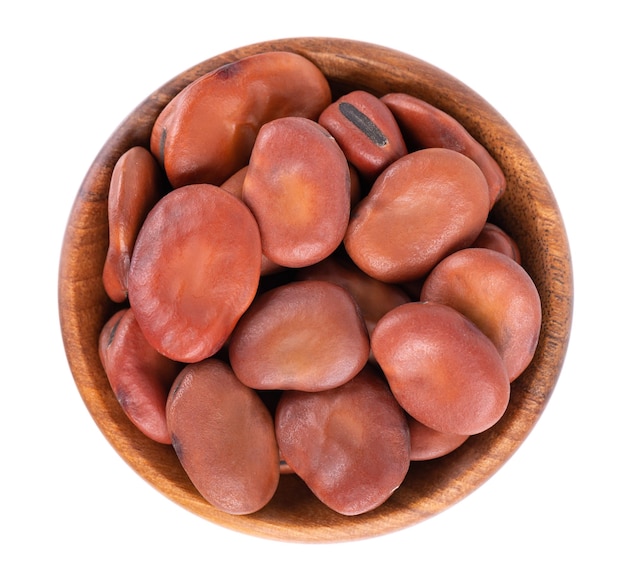
Identify the location of rim of the bowl. Image resolution: width=626 pixels, height=578 pixels. (458, 86), (516, 453), (106, 438).